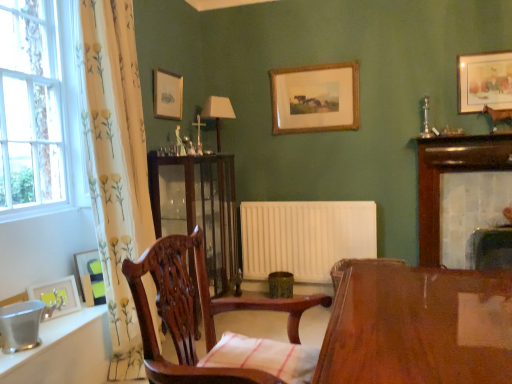
Locate an element on the screen. The width and height of the screenshot is (512, 384). free location above gold-framed picture at upper center, the second picture frame positioned from the right (from a real-world perspective) is located at coordinates (312, 65).